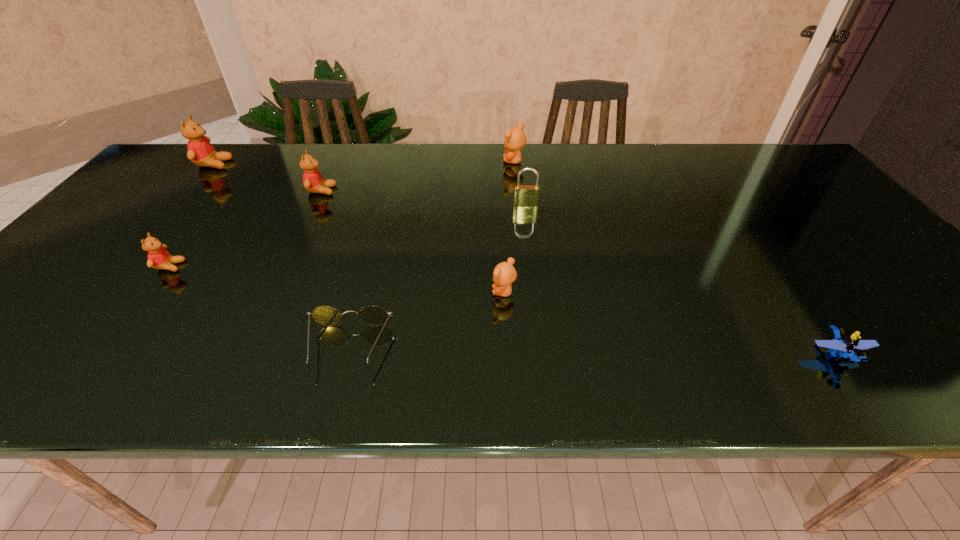
Where is `free space between the yellow spectacles and the leftmost red teddy bear`? Image resolution: width=960 pixels, height=540 pixels. free space between the yellow spectacles and the leftmost red teddy bear is located at coordinates (281, 255).

At what (x,y) coordinates should I click in order to perform the action: click on vacant region between the yellow spectacles and the third nearest object. Please return your answer as a coordinate pair (x, y). Image resolution: width=960 pixels, height=540 pixels. Looking at the image, I should click on (426, 320).

Find the location of a particular element. vacant point located between the second biggest red teddy bear and the bigger brown teddy bear is located at coordinates (418, 176).

Find the location of a particular element. The width and height of the screenshot is (960, 540). object that is the third closest to the leftmost object is located at coordinates (371, 315).

Select which object appears as the closest to the biggest red teddy bear. Please provide its 2D coordinates. Your answer should be formatted as a tuple, i.e. [(x, y)], where the tuple contains the x and y coordinates of a point satisfying the conditions above.

[(313, 182)]

Image resolution: width=960 pixels, height=540 pixels. I want to click on teddy bear that is the second closest to the spectacles, so pos(158,257).

Locate which teddy bear is the fourth closest to the smaller brown teddy bear. Please provide its 2D coordinates. Your answer should be formatted as a tuple, i.e. [(x, y)], where the tuple contains the x and y coordinates of a point satisfying the conditions above.

[(200, 151)]

Identify which red teddy bear is the nearest to the second object from left to right. Please provide its 2D coordinates. Your answer should be formatted as a tuple, i.e. [(x, y)], where the tuple contains the x and y coordinates of a point satisfying the conditions above.

[(313, 182)]

I want to click on red teddy bear that is the second closest to the padlock, so click(x=158, y=257).

Where is `free space that satisfies the following two spatial constraints: 1. on the face of the smaller brown teddy bear; 2. on the front-facing side of the yellow spectacles`? The width and height of the screenshot is (960, 540). free space that satisfies the following two spatial constraints: 1. on the face of the smaller brown teddy bear; 2. on the front-facing side of the yellow spectacles is located at coordinates 507,347.